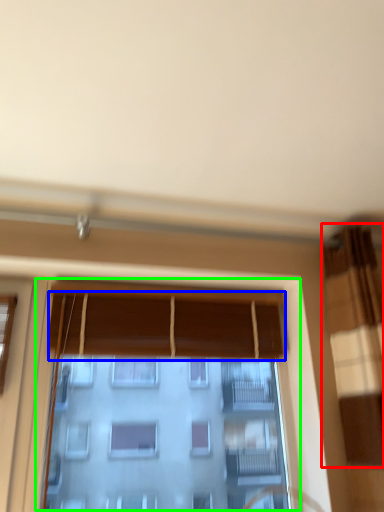
Question: Based on their relative distances, which object is nearer to curtain (highlighted by a red box)? Choose from curtain (highlighted by a blue box) and window (highlighted by a green box).

Choices:
 (A) curtain
 (B) window

Answer: (B)